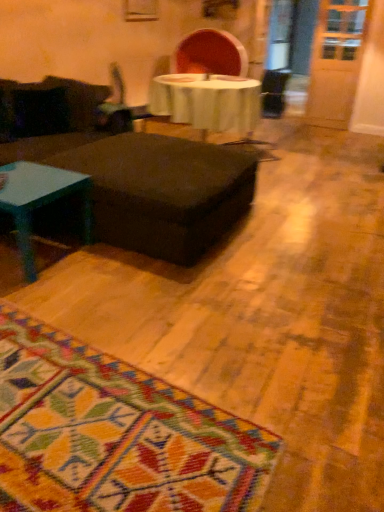
Question: Is teal glossy coffee table at left shorter than matte black ottoman at center?

Choices:
 (A) no
 (B) yes

Answer: (B)

Question: From the image's perspective, would you say teal glossy coffee table at left is positioned over matte black ottoman at center?

Choices:
 (A) yes
 (B) no

Answer: (B)

Question: Can you confirm if teal glossy coffee table at left is thinner than matte black ottoman at center?

Choices:
 (A) no
 (B) yes

Answer: (B)

Question: Is teal glossy coffee table at left turned away from matte black ottoman at center?

Choices:
 (A) yes
 (B) no

Answer: (B)

Question: Can you confirm if teal glossy coffee table at left is wider than matte black ottoman at center?

Choices:
 (A) yes
 (B) no

Answer: (B)

Question: From a real-world perspective, is teal glossy coffee table at left on top of matte black ottoman at center?

Choices:
 (A) no
 (B) yes

Answer: (A)

Question: Is matte black ottoman at center inside metallic silver swivel chair at center?

Choices:
 (A) yes
 (B) no

Answer: (B)

Question: From the image's perspective, would you say metallic silver swivel chair at center is positioned over matte black ottoman at center?

Choices:
 (A) yes
 (B) no

Answer: (A)

Question: Is metallic silver swivel chair at center positioned behind matte black ottoman at center?

Choices:
 (A) no
 (B) yes

Answer: (B)

Question: Can you confirm if metallic silver swivel chair at center is positioned to the left of matte black ottoman at center?

Choices:
 (A) yes
 (B) no

Answer: (A)

Question: From a real-world perspective, is metallic silver swivel chair at center positioned over matte black ottoman at center based on gravity?

Choices:
 (A) yes
 (B) no

Answer: (A)

Question: Does metallic silver swivel chair at center lie in front of matte black ottoman at center?

Choices:
 (A) no
 (B) yes

Answer: (A)

Question: Does matte black ottoman at center have a lesser width compared to metallic silver swivel chair at center?

Choices:
 (A) no
 (B) yes

Answer: (A)